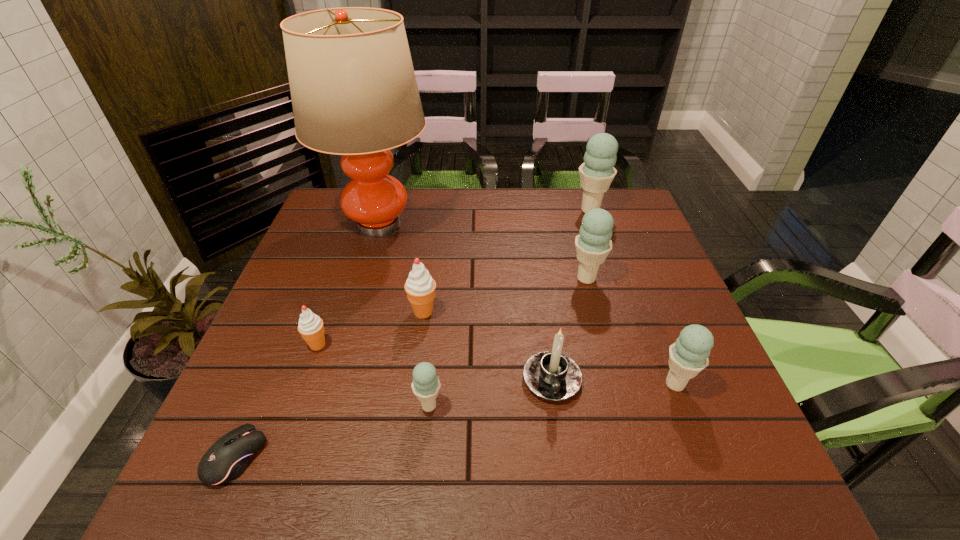
This screenshot has width=960, height=540. Identify the location of object situated at the far left corner. 354,93.

Locate an element on the screen. This screenshot has width=960, height=540. object that is at the near left corner is located at coordinates (229, 456).

Find the location of a particular element. object located at the far right corner is located at coordinates (597, 172).

The width and height of the screenshot is (960, 540). In order to click on blank space at the far edge in this screenshot , I will do `click(571, 201)`.

In the image, there is a desktop. In order to click on free space at the near edge in this screenshot , I will do `click(341, 494)`.

Find the location of a particular element. The width and height of the screenshot is (960, 540). vacant space at the left edge of the desktop is located at coordinates (276, 296).

Locate an element on the screen. Image resolution: width=960 pixels, height=540 pixels. free spot at the right edge of the desktop is located at coordinates (660, 419).

At what (x,y) coordinates should I click in order to perform the action: click on vacant space at the far right corner of the desktop. Please return your answer as a coordinate pair (x, y). The height and width of the screenshot is (540, 960). Looking at the image, I should click on (619, 220).

What are the coordinates of `vacant area that lies between the tallest object and the candle holder` in the screenshot? It's located at (466, 301).

Find the location of a particular element. Image resolution: width=960 pixels, height=540 pixels. vacant area that lies between the black computer mouse and the nearer red icecream is located at coordinates (276, 401).